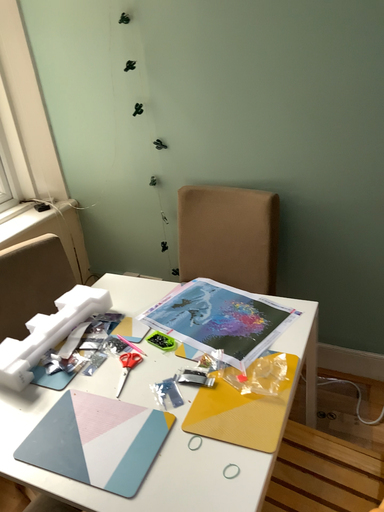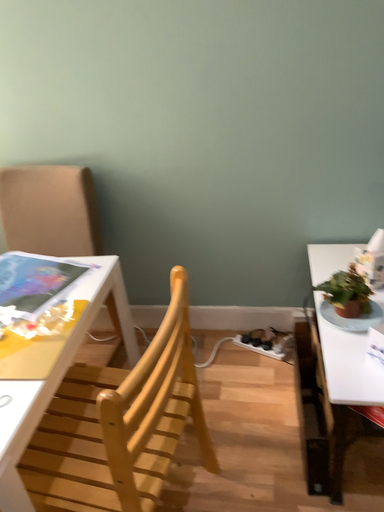
Question: How did the camera likely rotate when shooting the video?

Choices:
 (A) rotated right
 (B) rotated left

Answer: (A)